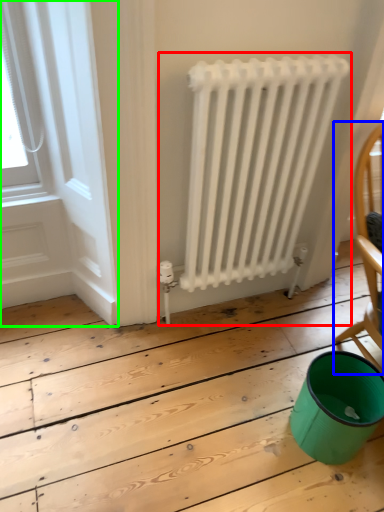
Question: Which object is positioned closest to radiator (highlighted by a red box)? Select from chair (highlighted by a blue box) and window frame (highlighted by a green box).

Choices:
 (A) chair
 (B) window frame

Answer: (A)